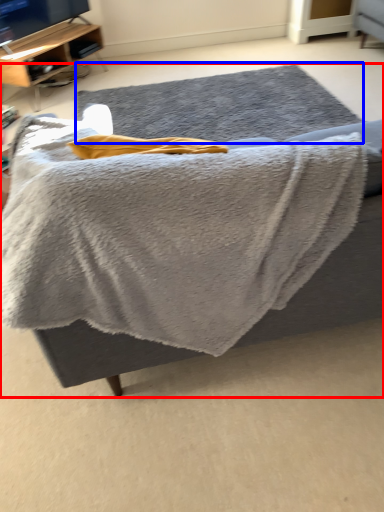
Question: Among these objects, which one is nearest to the camera, furniture (highlighted by a red box) or mat (highlighted by a blue box)?

Choices:
 (A) furniture
 (B) mat

Answer: (A)